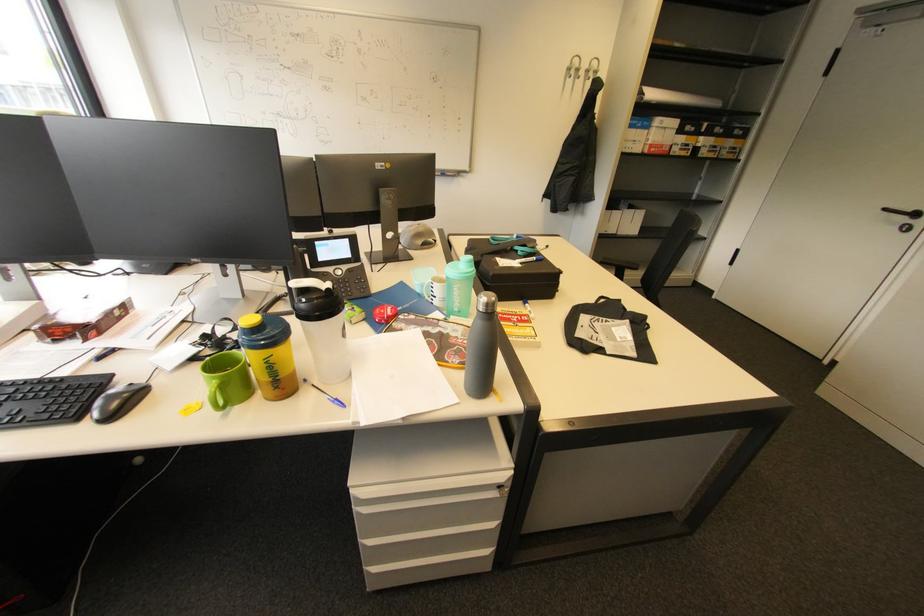
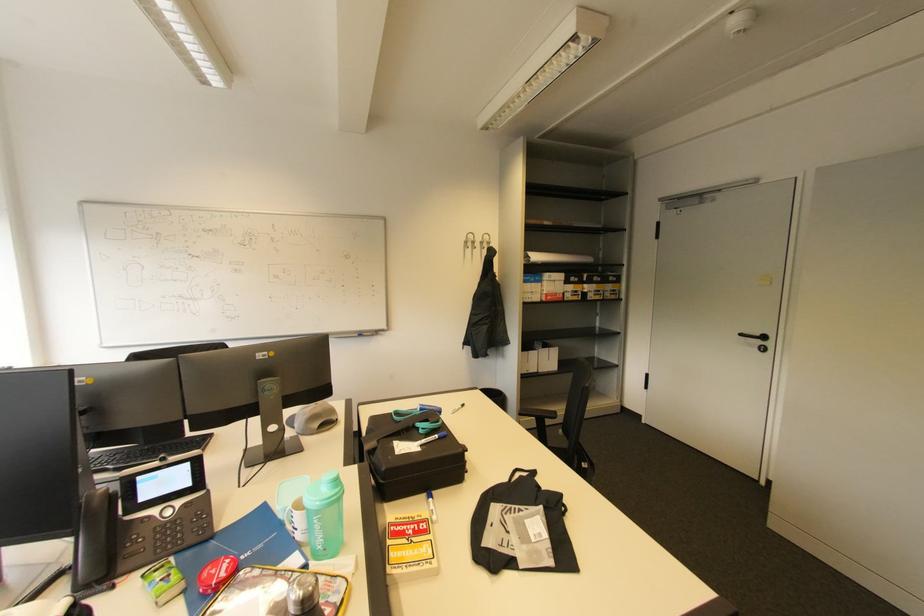
Locate, in the second image, the point that corresponds to point (617, 329) in the first image.

(531, 523)